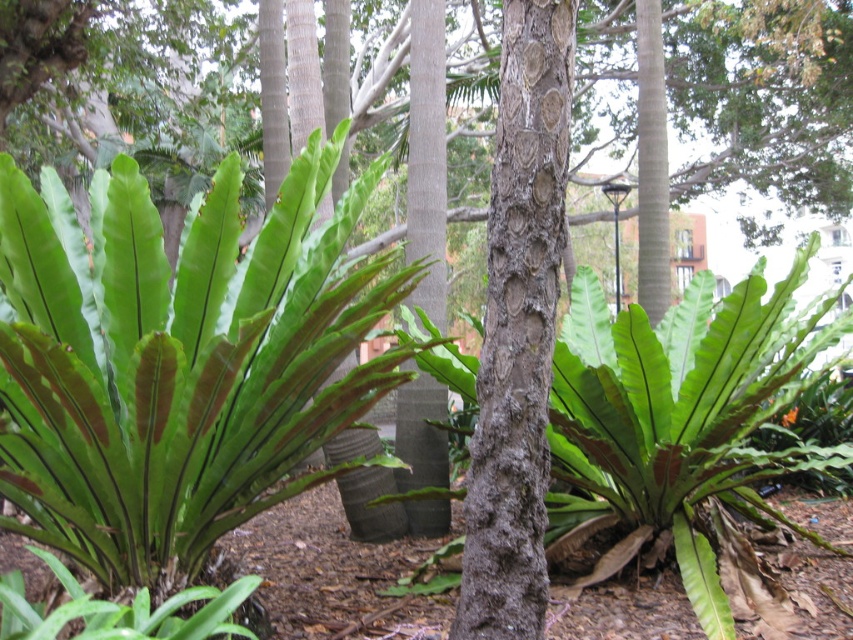
Question: Can you confirm if green matte leafy fern at center is positioned above green matte fern at center?

Choices:
 (A) yes
 (B) no

Answer: (A)

Question: Which point appears closest to the camera in this image?

Choices:
 (A) (560, 428)
 (B) (335, 308)

Answer: (B)

Question: Is green matte leafy fern at center below green matte fern at center?

Choices:
 (A) yes
 (B) no

Answer: (B)

Question: Is green matte leafy fern at center wider than green matte fern at center?

Choices:
 (A) no
 (B) yes

Answer: (A)